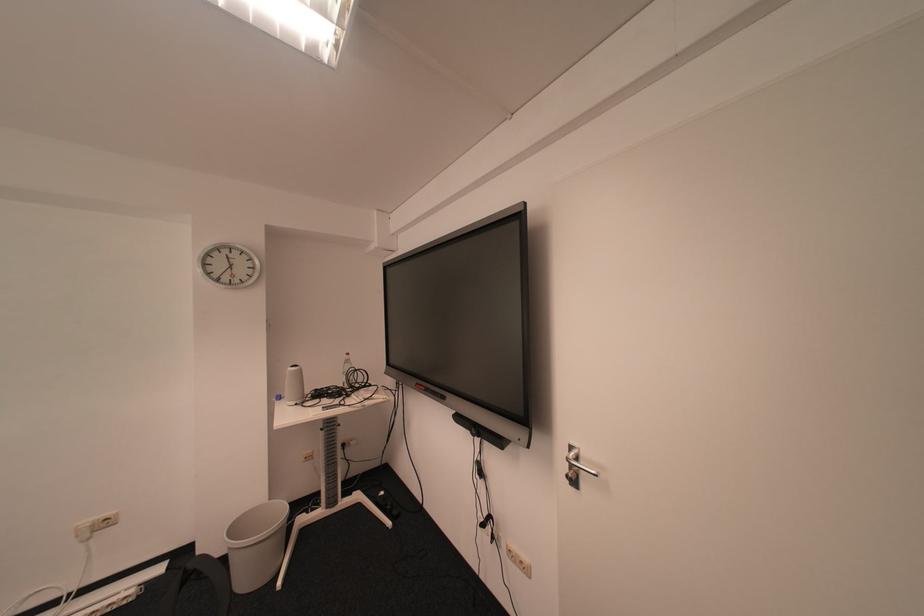
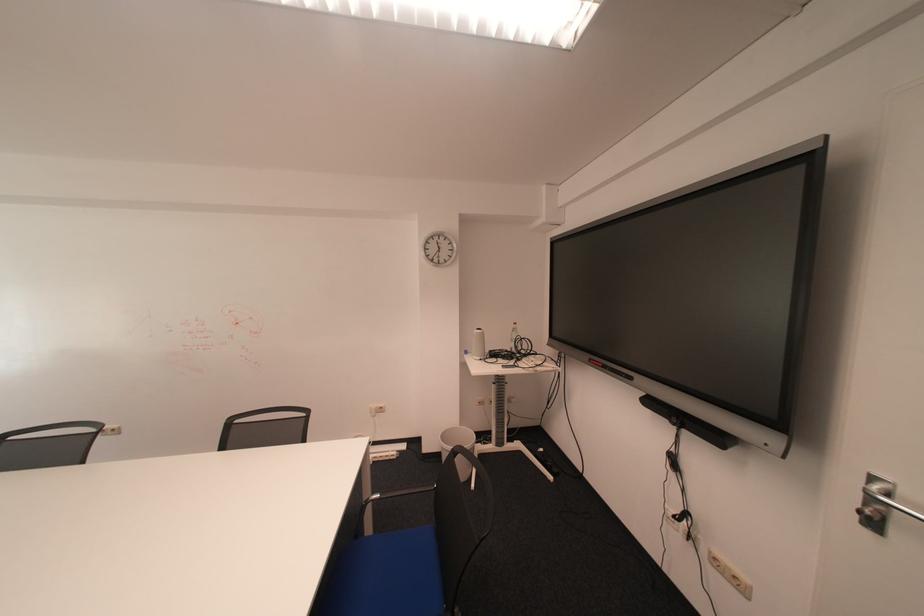
Question: The camera is either moving clockwise (left) or counter-clockwise (right) around the object. The first image is from the beginning of the video and the second image is from the end. Is the camera moving left or right when shooting the video?

Choices:
 (A) Left
 (B) Right

Answer: (B)